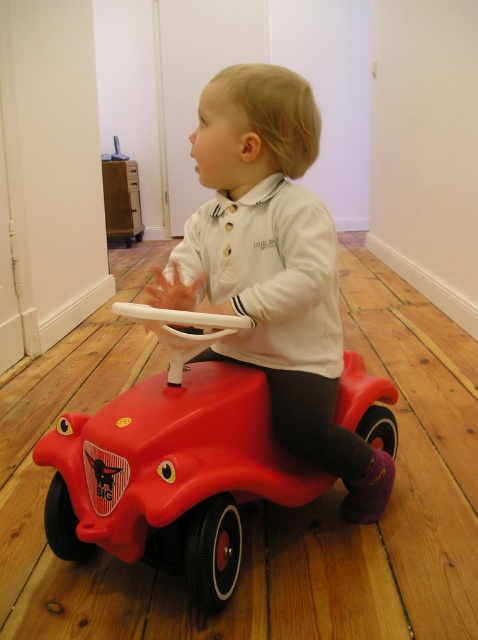
Can you confirm if rubberized matte red toy car at center is wider than matte plastic child at center?

Correct, the width of rubberized matte red toy car at center exceeds that of matte plastic child at center.

Between rubberized matte red toy car at center and matte plastic child at center, which one is positioned higher?

matte plastic child at center is above.

Locate an element on the screen. rubberized matte red toy car at center is located at coordinates (172, 465).